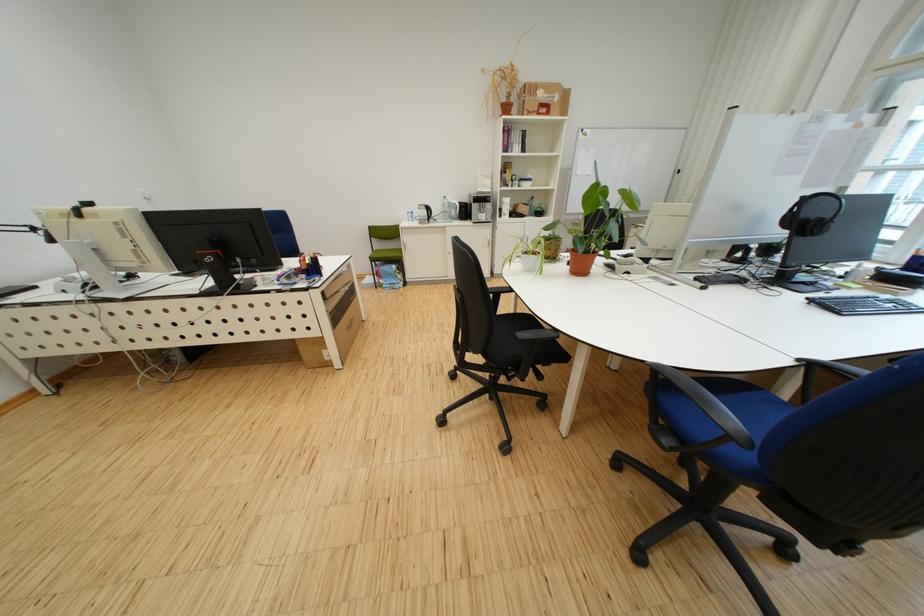
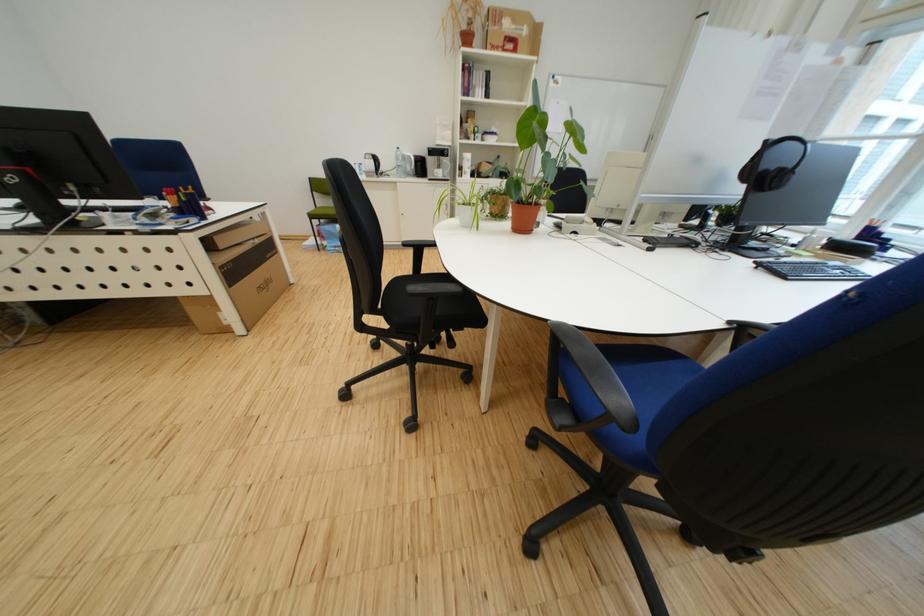
Locate, in the second image, the point that corresponds to pixel 306 342 in the first image.

(186, 301)